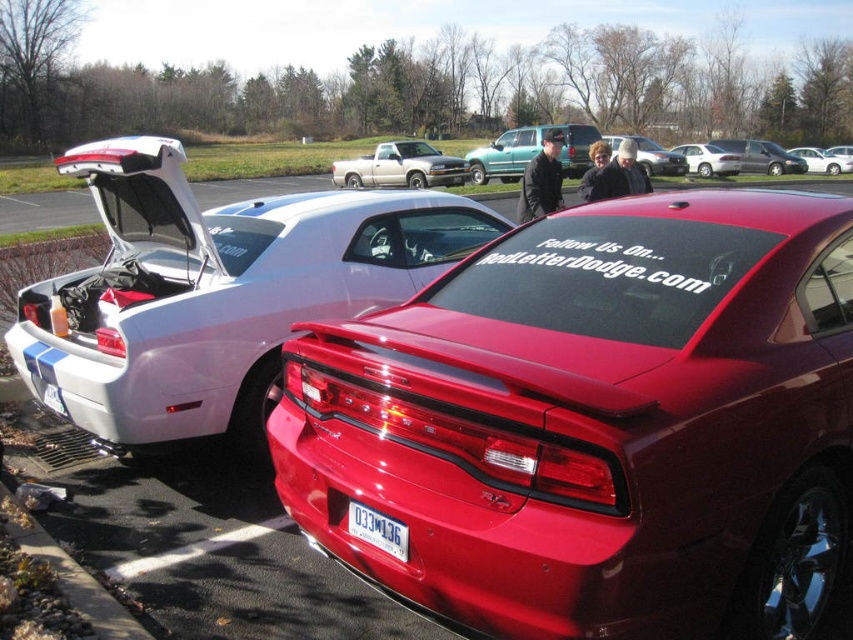
You are a delivery person trying to find a parking spot. You see the white glossy car at left and the metallic silver minivan at upper right. Which vehicle is closer to the ground?

The white glossy car at left is below metallic silver minivan at upper right, meaning it is closer to the ground.

You are a parking attendant who needs to move the white glossy car at left and the metallic silver minivan at upper right. Based on their current positions, which car is closer to the parking lot entrance?

The white glossy car at left is positioned on the left side of the metallic silver minivan at upper right. Since it is to the left of the minivan, it is likely closer to the parking lot entrance than the metallic silver minivan at upper right.

You are standing in the parking lot and want to take a photo of both the shiny red car at center and the metallic silver sedan at center. Which car should you position yourself closer to in order to capture both in the same frame?

The shiny red car at center is below the metallic silver sedan at center, so positioning yourself closer to the shiny red car at center will allow you to capture both cars in the same frame as the silver sedan is higher up.